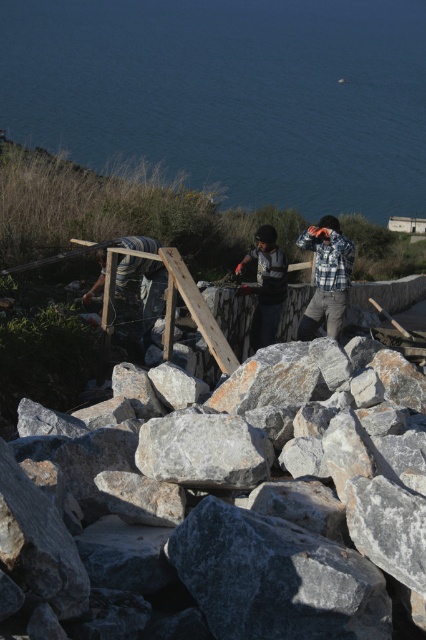
You are a construction worker standing at the base of the stone wall. You need to ensure that the wooden beams supporting the wall are aligned correctly. To do this, you decide to use a laser level pointed towards the blue water at upper center. What coordinates should you set the laser level to aim at?

The coordinates to aim the laser level at the blue water at upper center should be set to point (230,93) as specified in the object description.

You are standing at the viewer position and want to reach point (290, 188). Can you walk directly to it without any obstacles?

The distance between the viewer and point (290, 188) is 40.34 meters. Since there are no obstacles mentioned in the scene description, you can walk directly to it.

You are a construction worker standing at the base of the stone wall. You need to ensure safety by keeping a safe distance from the blue water at upper center. What is the minimum distance you should maintain to stay safe?

The blue water at upper center is 35.27 meters away from the viewer. To maintain a safe distance, you should stay at least 35.27 meters away from the blue water at upper center.